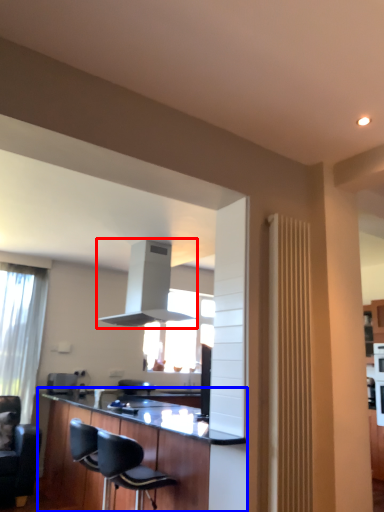
Question: Which object is closer to the camera taking this photo, exhaust hood (highlighted by a red box) or cabinetry (highlighted by a blue box)?

Choices:
 (A) exhaust hood
 (B) cabinetry

Answer: (B)